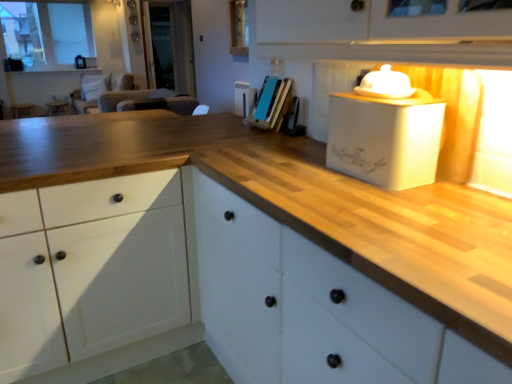
Question: Is transparent glass door at center shorter than white wood cabinet at center?

Choices:
 (A) no
 (B) yes

Answer: (A)

Question: Considering the relative positions of transparent glass door at center and white wood cabinet at center in the image provided, is transparent glass door at center to the right of white wood cabinet at center from the viewer's perspective?

Choices:
 (A) no
 (B) yes

Answer: (A)

Question: Considering the relative positions of transparent glass door at center and white wood cabinet at center in the image provided, is transparent glass door at center behind white wood cabinet at center?

Choices:
 (A) yes
 (B) no

Answer: (A)

Question: Considering the relative sizes of transparent glass door at center and white wood cabinet at center in the image provided, is transparent glass door at center thinner than white wood cabinet at center?

Choices:
 (A) no
 (B) yes

Answer: (B)

Question: Does transparent glass door at center have a larger size compared to white wood cabinet at center?

Choices:
 (A) no
 (B) yes

Answer: (A)

Question: Does transparent glass door at center appear on the left side of white wood cabinet at center?

Choices:
 (A) no
 (B) yes

Answer: (B)

Question: Are white wood cabinet at center and white glass window at upper left far apart?

Choices:
 (A) yes
 (B) no

Answer: (A)

Question: From the image's perspective, is white wood cabinet at center above white glass window at upper left?

Choices:
 (A) yes
 (B) no

Answer: (B)

Question: Is white wood cabinet at center oriented away from white glass window at upper left?

Choices:
 (A) yes
 (B) no

Answer: (B)

Question: Is white wood cabinet at center wider than white glass window at upper left?

Choices:
 (A) yes
 (B) no

Answer: (A)

Question: Is white wood cabinet at center to the left of white glass window at upper left from the viewer's perspective?

Choices:
 (A) yes
 (B) no

Answer: (B)

Question: Considering the relative sizes of white wood cabinet at center and white glass window at upper left in the image provided, is white wood cabinet at center shorter than white glass window at upper left?

Choices:
 (A) yes
 (B) no

Answer: (A)

Question: Is white matte box at upper right, which ranks as the second appliance in top-to-bottom order, bigger than white ceramic lid at upper right, the 2th appliance ordered from the bottom?

Choices:
 (A) yes
 (B) no

Answer: (A)